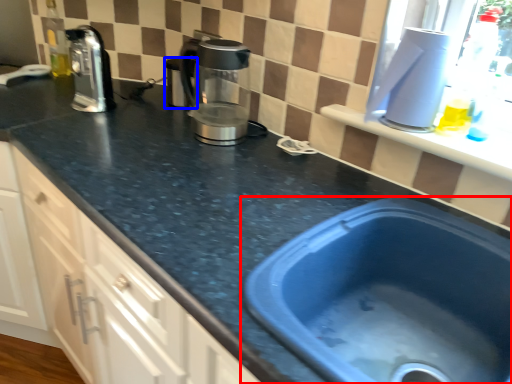
Question: Which of the following is the farthest to the observer, sink (highlighted by a red box) or appliance (highlighted by a blue box)?

Choices:
 (A) sink
 (B) appliance

Answer: (B)